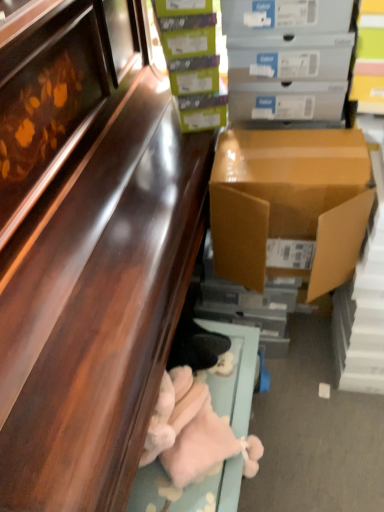
Locate an element on the screen. vacant point above fluffy pink stuffed animal at lower center (from a real-world perspective) is located at coordinates (195, 435).